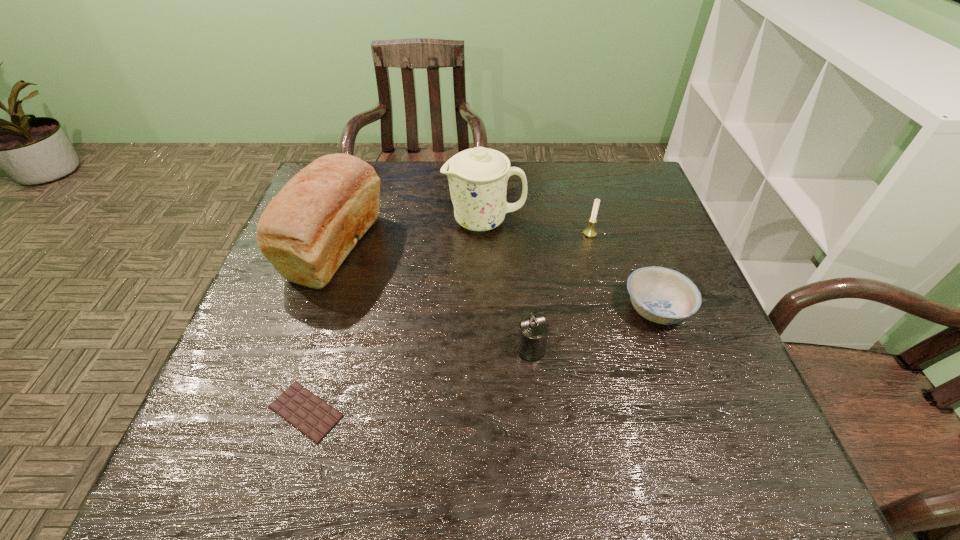
What are the coordinates of `chocolate bar situated at the left edge` in the screenshot? It's located at (311, 415).

Identify the location of object situated at the right edge. click(661, 295).

This screenshot has height=540, width=960. Identify the location of object located in the far left corner section of the desktop. (308, 229).

You are a GUI agent. You are given a task and a screenshot of the screen. Output one action in this format:
    pyautogui.click(x=<x>, y=<y>)
    Task: Click on the object located at the near left corner
    
    Given the screenshot: What is the action you would take?
    pos(311,415)

In the image, there is a desktop. At what (x,y) coordinates should I click in order to perform the action: click on vacant space at the far edge. Please return your answer as a coordinate pair (x, y). The image size is (960, 540). Looking at the image, I should click on (548, 198).

The image size is (960, 540). Identify the location of vacant region at the near edge of the desktop. (658, 444).

In the image, there is a desktop. Identify the location of vacant space at the left edge. (288, 316).

Where is `vacant space at the right edge of the desktop`? The width and height of the screenshot is (960, 540). vacant space at the right edge of the desktop is located at coordinates (709, 372).

Find the location of `blank area at the near left corner`. blank area at the near left corner is located at coordinates (235, 454).

In the image, there is a desktop. Where is `vacant region at the far right corner`? This screenshot has width=960, height=540. vacant region at the far right corner is located at coordinates (595, 163).